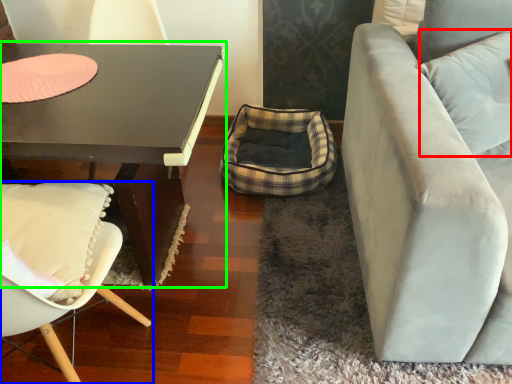
Question: Which is nearer to the pillow (highlighted by a red box)? chair (highlighted by a blue box) or coffee table (highlighted by a green box).

Choices:
 (A) chair
 (B) coffee table

Answer: (B)